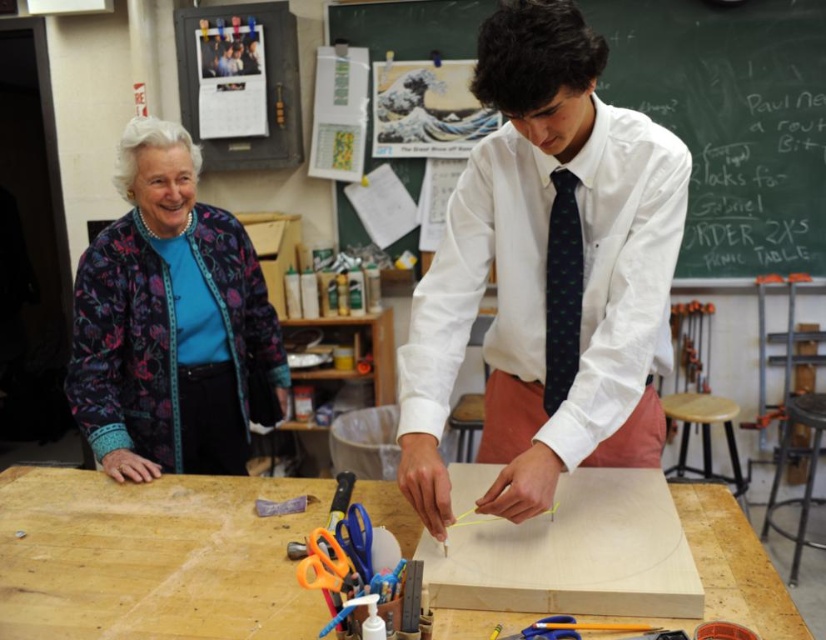
You are standing at the workbench and need to locate two specific points marked on the wood. The first point is at coordinates point (786,129) and the second at point (93,401). Which point is closer to the edge of the wood?

Point (786,129) is closer to the edge of the wood because it is positioned behind point (93,401).

You are organizing a workshop and need to ensure that the white smooth shirt at center and the wooden stool at right can fit on a shelf that can hold items up to 1 meter in length. Based on their sizes, will both items fit on the shelf?

The white smooth shirt at center is larger than the wooden stool at right, but since the shelf can hold items up to 1 meter in length, both items will fit as long as their individual lengths do not exceed 1 meter. However, without specific measurements, we cannot confirm if the larger shirt exceeds the limit.